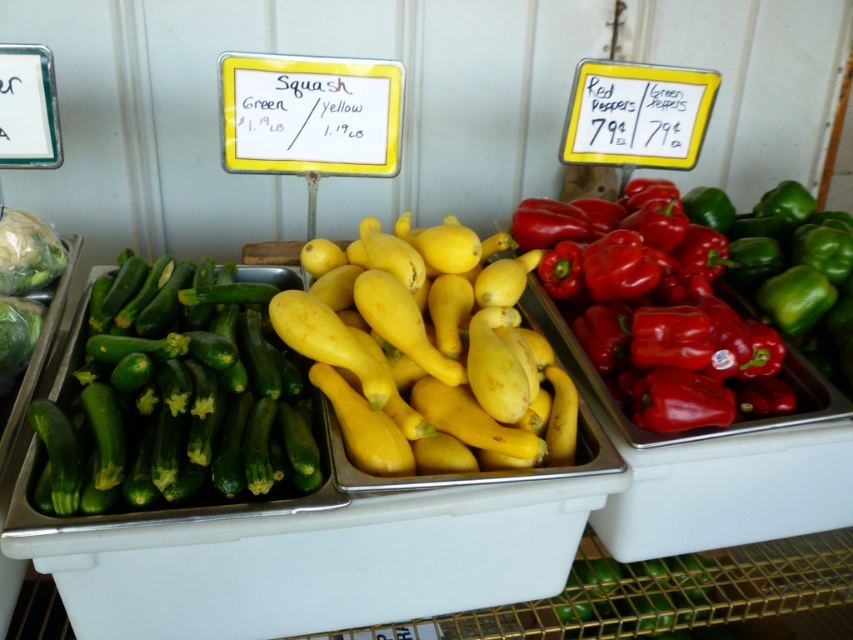
You are a grocery store employee who needs to arrange these vegetables in order from smallest to largest. Given the yellow matte squash at center and the green smooth zucchini at left, which should come first?

The green smooth zucchini at left should come first since it is smaller than the yellow matte squash at center.

You are a customer at the market trying to decide between the yellow matte squash at center and the green smooth zucchini at left. Which vegetable is wider?

The yellow matte squash at center is wider than the green smooth zucchini at left.

You are a grocery worker who needs to place a 6 inch long cucumber between the yellow matte squash at center and the green smooth zucchini at left. Is there enough space to fit it without moving the existing vegetables?

The yellow matte squash at center and green smooth zucchini at left are 5.22 inches apart from each other. Since the cucumber is 6 inches long, there isn not enough space to fit it between them without moving the existing vegetables.